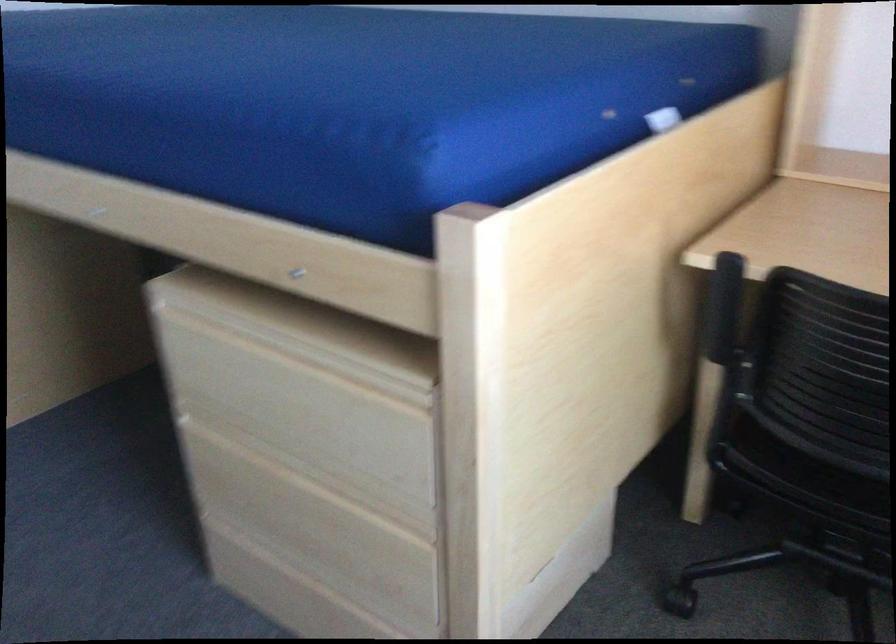
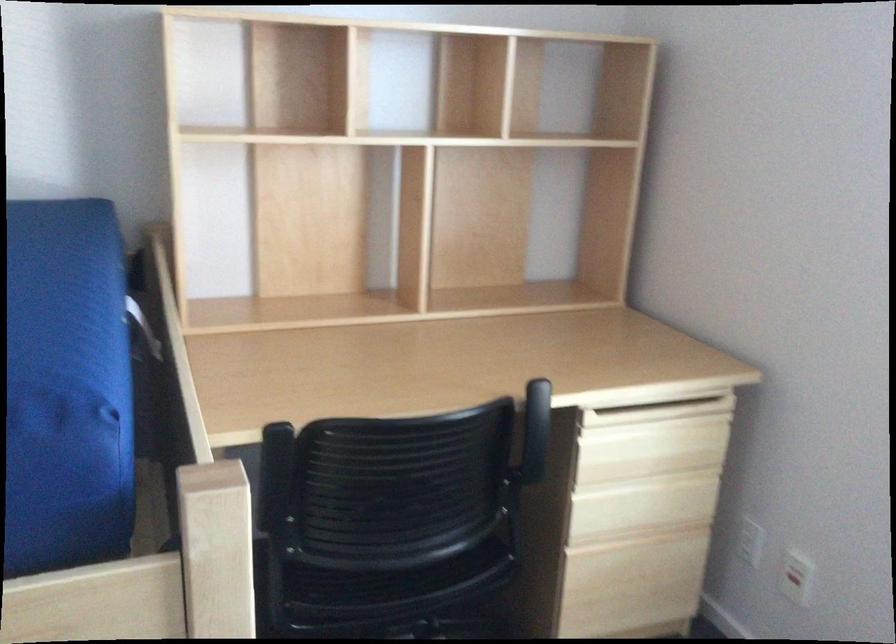
Question: The images are taken continuously from a first-person perspective. In which direction is your viewpoint rotating?

Choices:
 (A) Left
 (B) Right
 (C) Up
 (D) Down

Answer: (B)